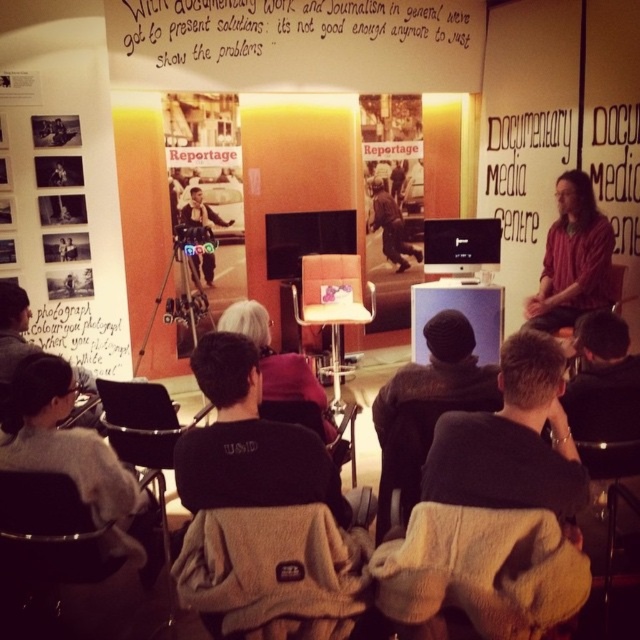
Question: Does dark brown sweater at center appear on the left side of matte red shirt at right?

Choices:
 (A) yes
 (B) no

Answer: (A)

Question: Estimate the real-world distances between objects in this image. Which object is closer to the dark gray sweater at center?

Choices:
 (A) fuzzy fleece chair at lower center
 (B) matte black camera at center

Answer: (A)

Question: Can you confirm if matte red shirt at right is positioned to the right of wooden textured chair at lower right?

Choices:
 (A) no
 (B) yes

Answer: (B)

Question: Can you confirm if black fleece jacket at center is positioned to the left of light gray sweater at lower left?

Choices:
 (A) yes
 (B) no

Answer: (B)

Question: Which point is closer to the camera taking this photo?

Choices:
 (A) (211, 268)
 (B) (120, 467)

Answer: (B)

Question: Estimate the real-world distances between objects in this image. Which object is farther from the matte black camera at center?

Choices:
 (A) beige fabric chair at lower center
 (B) leather-like chair at center
 (C) black fleece jacket at center
 (D) dark gray knit hat at center

Answer: (A)